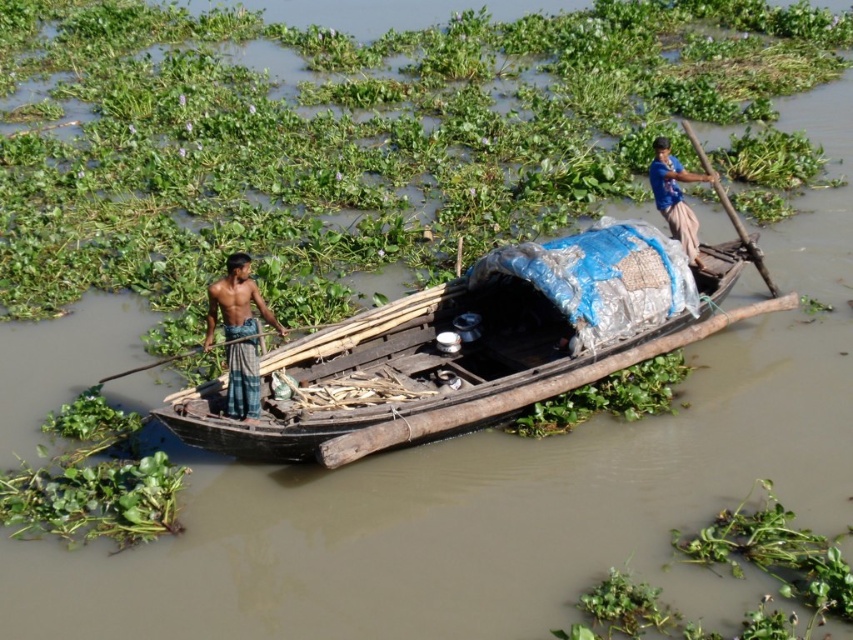
Question: Does shiny blue shirt at left have a greater width compared to blue fabric at upper right?

Choices:
 (A) yes
 (B) no

Answer: (B)

Question: Where is blue fabric at upper right located in relation to wooden paddle at left in the image?

Choices:
 (A) left
 (B) right

Answer: (B)

Question: Considering the real-world distances, which object is closest to the shiny blue shirt at left?

Choices:
 (A) wooden paddle at left
 (B) wooden paddle at right

Answer: (A)

Question: Which object is positioned closest to the wooden boat at center?

Choices:
 (A) blue fabric at upper right
 (B) wooden paddle at right

Answer: (A)

Question: Which of the following is the closest to the observer?

Choices:
 (A) (320, 326)
 (B) (721, 202)
 (C) (550, 259)
 (D) (251, 333)

Answer: (D)

Question: Does shiny blue shirt at left lie behind wooden paddle at left?

Choices:
 (A) yes
 (B) no

Answer: (B)